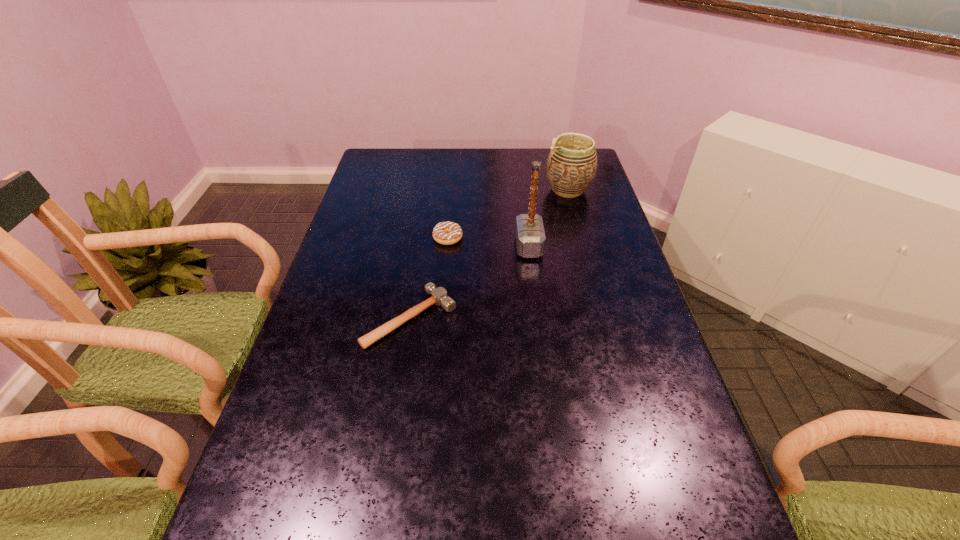
This screenshot has height=540, width=960. What are the coordinates of `free space located 0.130m on the front of the pottery` in the screenshot? It's located at (578, 226).

The width and height of the screenshot is (960, 540). Find the location of `vacant region located 0.120m on the front of the doughnut`. vacant region located 0.120m on the front of the doughnut is located at coordinates (444, 274).

Find the location of a particular element. The height and width of the screenshot is (540, 960). vacant space located 0.280m on the front of the nearest object is located at coordinates (388, 468).

Find the location of a particular element. The height and width of the screenshot is (540, 960). object that is positioned at the far edge is located at coordinates (571, 166).

Locate an element on the screen. The width and height of the screenshot is (960, 540). object positioned at the left edge is located at coordinates (439, 296).

This screenshot has width=960, height=540. In order to click on object that is at the right edge in this screenshot , I will do `click(571, 166)`.

Identify the location of object that is at the far right corner. (571, 166).

The width and height of the screenshot is (960, 540). In the image, there is a desktop. Find the location of `free space at the far edge`. free space at the far edge is located at coordinates (428, 164).

Where is `vacant space at the left edge`? vacant space at the left edge is located at coordinates (328, 404).

Where is `free space at the right edge`? The width and height of the screenshot is (960, 540). free space at the right edge is located at coordinates (592, 183).